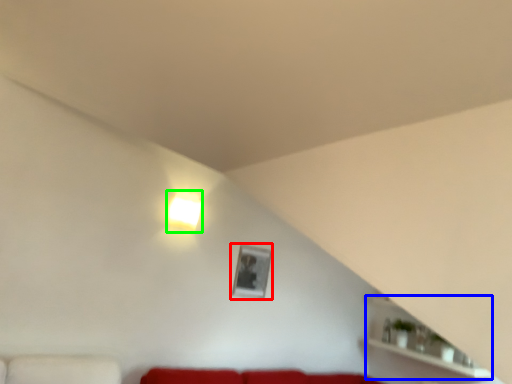
Question: Which object is the farthest from picture frame (highlighted by a red box)? Choose among these: shelf (highlighted by a blue box) or lamp (highlighted by a green box).

Choices:
 (A) shelf
 (B) lamp

Answer: (A)